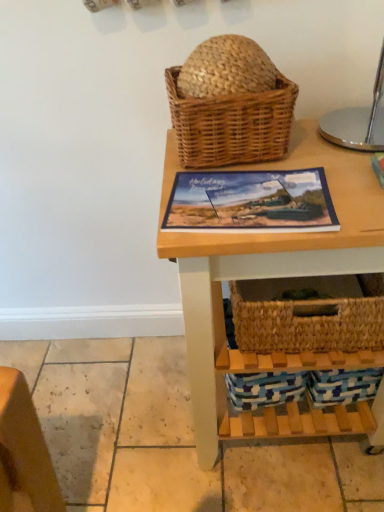
Locate an element on the screen. This screenshot has width=384, height=512. vacant space behind matte plastic picture frame at center is located at coordinates (259, 161).